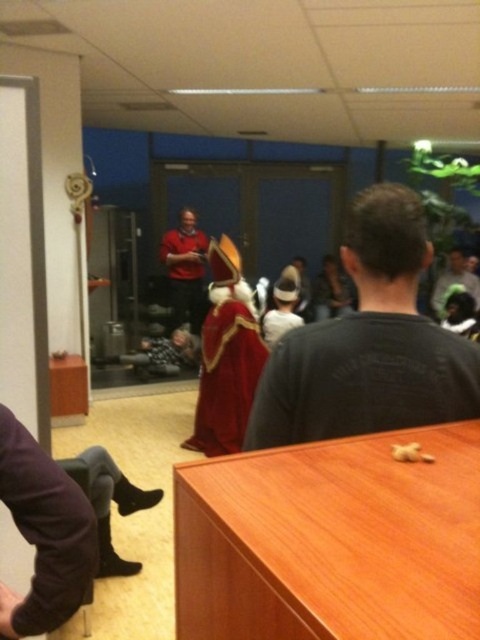
You are standing in the room and want to reach the velvet red cape at center. The room has a door 4 meters away from you. Can you reach the cape before exiting through the door?

The velvet red cape at center is 3.80 meters away from the viewer, which is slightly closer than the 4 meters distance to the door. Therefore, you can reach the velvet red cape at center before exiting through the door.